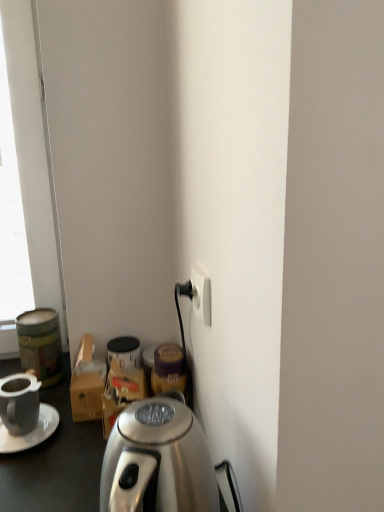
Question: Is matte black mug at lower left completely or partially outside of white plastic power outlet at lower right?

Choices:
 (A) no
 (B) yes

Answer: (B)

Question: Is white plastic power outlet at lower right surrounded by matte black mug at lower left?

Choices:
 (A) yes
 (B) no

Answer: (B)

Question: Can you confirm if matte black mug at lower left is shorter than white plastic power outlet at lower right?

Choices:
 (A) yes
 (B) no

Answer: (B)

Question: Would you say matte black mug at lower left is a long distance from white plastic power outlet at lower right?

Choices:
 (A) no
 (B) yes

Answer: (A)

Question: Can you confirm if matte black mug at lower left is taller than white plastic power outlet at lower right?

Choices:
 (A) yes
 (B) no

Answer: (A)

Question: From the image's perspective, is matte black mug at lower left located beneath white plastic power outlet at lower right?

Choices:
 (A) yes
 (B) no

Answer: (A)

Question: Would you say white plastic power outlet at lower right is outside white matte saucer at left?

Choices:
 (A) yes
 (B) no

Answer: (A)

Question: Can you confirm if white plastic power outlet at lower right is positioned to the left of white matte saucer at left?

Choices:
 (A) yes
 (B) no

Answer: (B)

Question: Is white plastic power outlet at lower right smaller than white matte saucer at left?

Choices:
 (A) no
 (B) yes

Answer: (B)

Question: From the image's perspective, would you say white plastic power outlet at lower right is shown under white matte saucer at left?

Choices:
 (A) no
 (B) yes

Answer: (A)

Question: Would you say white matte saucer at left is part of white plastic power outlet at lower right's contents?

Choices:
 (A) yes
 (B) no

Answer: (B)

Question: Is white plastic power outlet at lower right far away from white matte saucer at left?

Choices:
 (A) no
 (B) yes

Answer: (A)

Question: Is metallic green canister at left positioned far away from matte black mug at lower left?

Choices:
 (A) yes
 (B) no

Answer: (B)